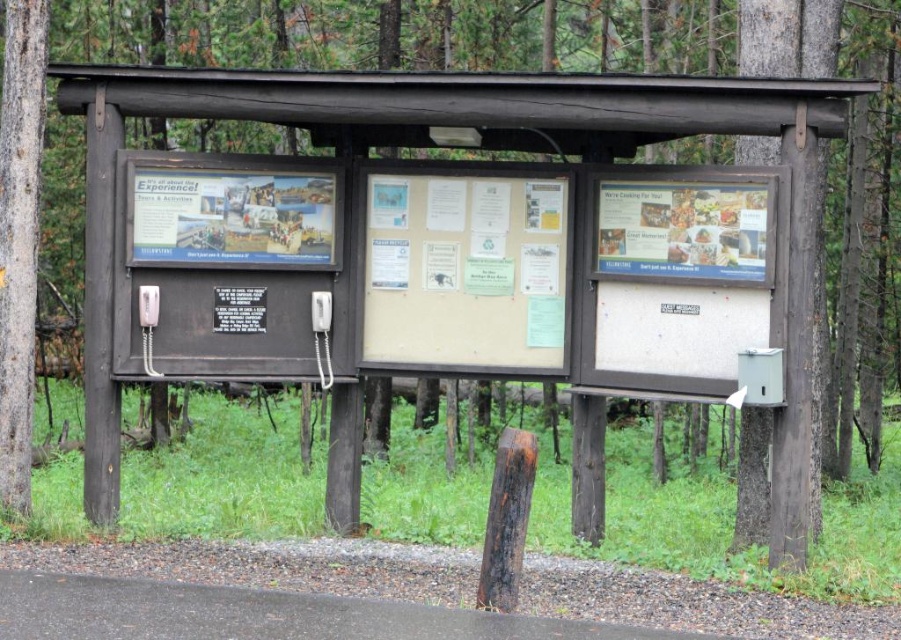
Question: Can you confirm if metallic gray phone box at lower right is wider than white plastic payphone at center?

Choices:
 (A) no
 (B) yes

Answer: (B)

Question: Estimate the real-world distances between objects in this image. Which object is closer to the wooden bus stop at center?

Choices:
 (A) rusty wood post at lower center
 (B) smooth gray bark at left
 (C) metallic gray phone box at lower right
 (D) white plastic payphone at center

Answer: (C)

Question: Estimate the real-world distances between objects in this image. Which object is farther from the metallic gray phone box at lower right?

Choices:
 (A) smooth gray bark at left
 (B) wooden bus stop at center
 (C) white plastic payphone at center

Answer: (A)

Question: Does smooth gray bark at left lie in front of metallic gray phone box at lower right?

Choices:
 (A) yes
 (B) no

Answer: (B)

Question: Is rusty wood post at lower center smaller than white plastic payphone at center?

Choices:
 (A) yes
 (B) no

Answer: (B)

Question: Estimate the real-world distances between objects in this image. Which object is farther from the wooden bus stop at center?

Choices:
 (A) smooth gray bark at left
 (B) metallic gray phone box at lower right
 (C) white plastic payphone at center
 (D) rusty wood post at lower center

Answer: (D)